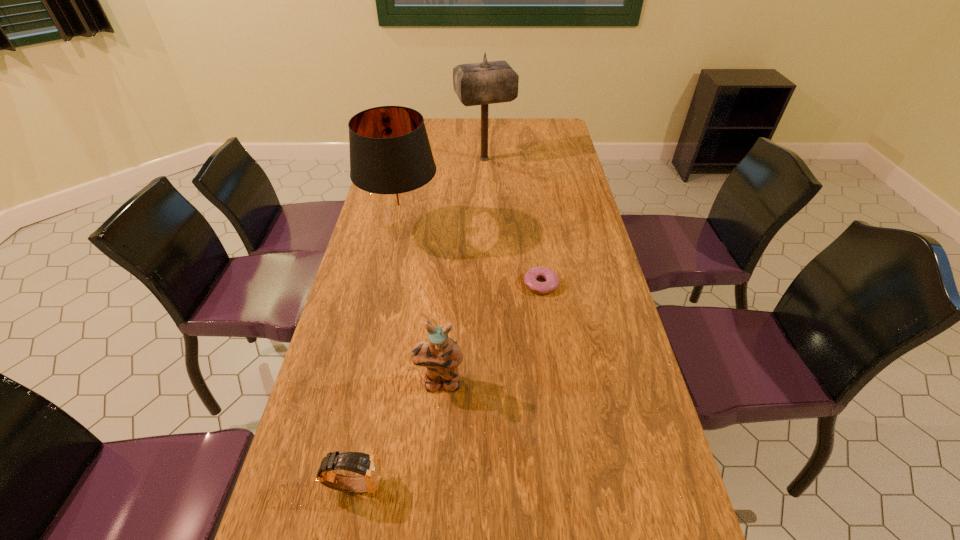
At what (x,y) coordinates should I click in order to perform the action: click on free space between the figurine and the farthest object. Please return your answer as a coordinate pair (x, y). The width and height of the screenshot is (960, 540). Looking at the image, I should click on [463, 271].

Locate an element on the screen. This screenshot has width=960, height=540. free space that is in between the farthest object and the figurine is located at coordinates (463, 271).

You are a GUI agent. You are given a task and a screenshot of the screen. Output one action in this format:
    pyautogui.click(x=<x>, y=<y>)
    Task: Click on the empty space that is in between the third nearest object and the fourth nearest object
    This screenshot has height=540, width=960.
    Given the screenshot: What is the action you would take?
    click(471, 257)

Find the location of `free area in between the watch and the figurine`. free area in between the watch and the figurine is located at coordinates (397, 433).

Locate an element on the screen. vacant point located between the fourth nearest object and the shortest object is located at coordinates (471, 257).

Identify the location of free space that is in between the farthest object and the lampshade. Image resolution: width=960 pixels, height=540 pixels. (444, 194).

Locate an element on the screen. The height and width of the screenshot is (540, 960). unoccupied area between the watch and the second farthest object is located at coordinates (378, 357).

Choose which object is the third nearest neighbor to the farthest object. Please provide its 2D coordinates. Your answer should be formatted as a tuple, i.e. [(x, y)], where the tuple contains the x and y coordinates of a point satisfying the conditions above.

[(441, 356)]

Identify which object is the second nearest to the fourth nearest object. Please provide its 2D coordinates. Your answer should be formatted as a tuple, i.e. [(x, y)], where the tuple contains the x and y coordinates of a point satisfying the conditions above.

[(530, 278)]

Where is `free space that satisfies the following two spatial constraints: 1. on the front-facing side of the third tallest object; 2. on the face of the second shortest object`? free space that satisfies the following two spatial constraints: 1. on the front-facing side of the third tallest object; 2. on the face of the second shortest object is located at coordinates (432, 484).